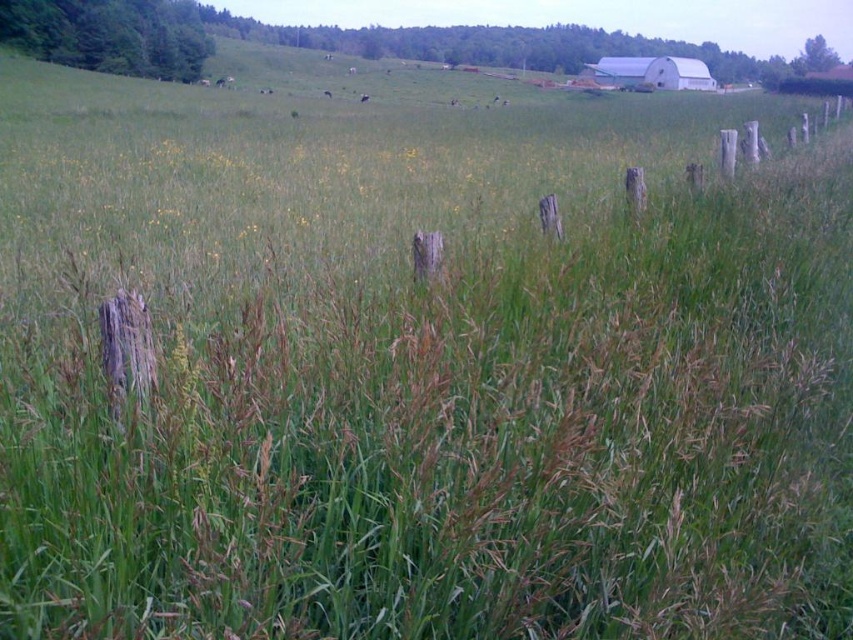
Between weathered wood fence posts at center and white matte barn at upper right, which one appears on the left side from the viewer's perspective?

Positioned to the left is weathered wood fence posts at center.

Does weathered wood fence posts at center have a lesser height compared to white matte barn at upper right?

No, weathered wood fence posts at center is not shorter than white matte barn at upper right.

Does point (746, 205) come farther from viewer compared to point (697, 81)?

No, (746, 205) is in front of (697, 81).

This screenshot has width=853, height=640. What are the coordinates of `weathered wood fence posts at center` in the screenshot? It's located at (622, 195).